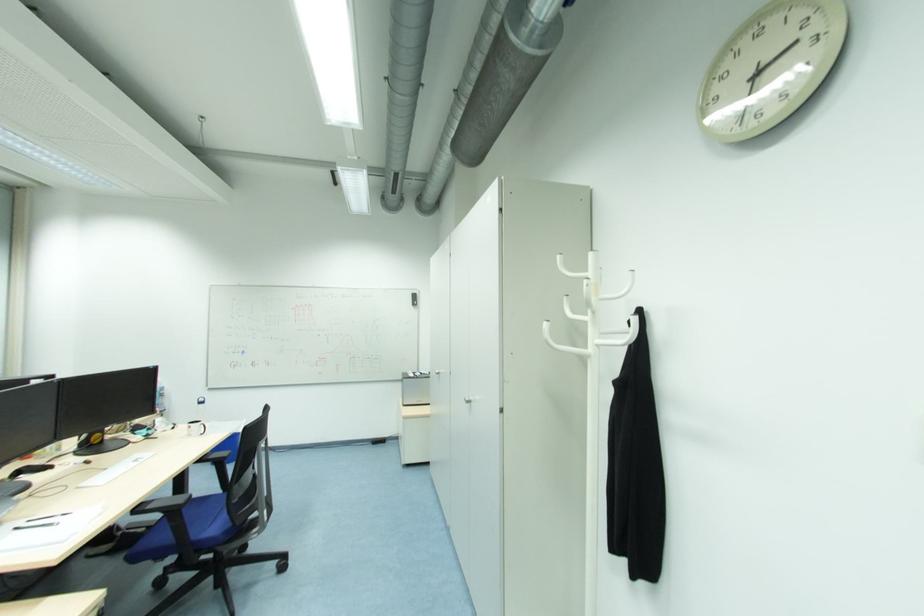
Describe the element at coordinates (468, 398) in the screenshot. I see `the silver cabinet handle` at that location.